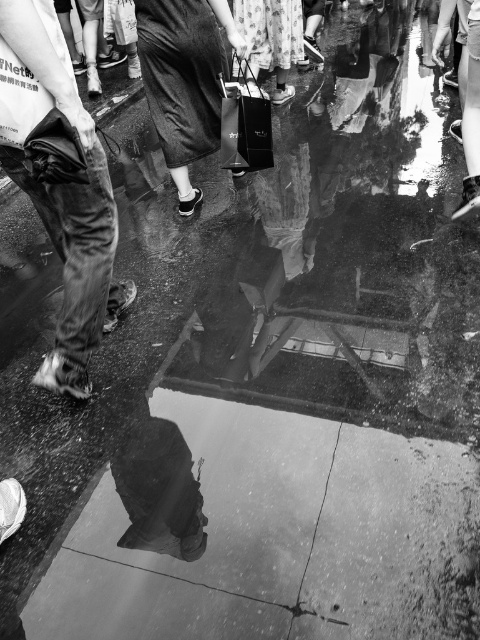
You are standing on the smooth concrete sidewalk at lower center and want to place the matte black shopping bag at center on the ground. Will the bag fit entirely on the sidewalk?

The smooth concrete sidewalk at lower center has a larger size compared to matte black shopping bag at center, so yes, the bag will fit entirely on the sidewalk.

You are a photographer trying to capture the reflection of the smooth concrete sidewalk at lower center and the matte black shopping bag at center in the puddle. Which object will have a wider reflection in the puddle?

The smooth concrete sidewalk at lower center has a wider reflection in the puddle because its width surpasses that of the matte black shopping bag at center.

You are standing on the street and see the smooth concrete sidewalk at lower center and the jeans at left. Which object is closer to your feet?

The smooth concrete sidewalk at lower center is closer to your feet because it is located below the jeans at left.